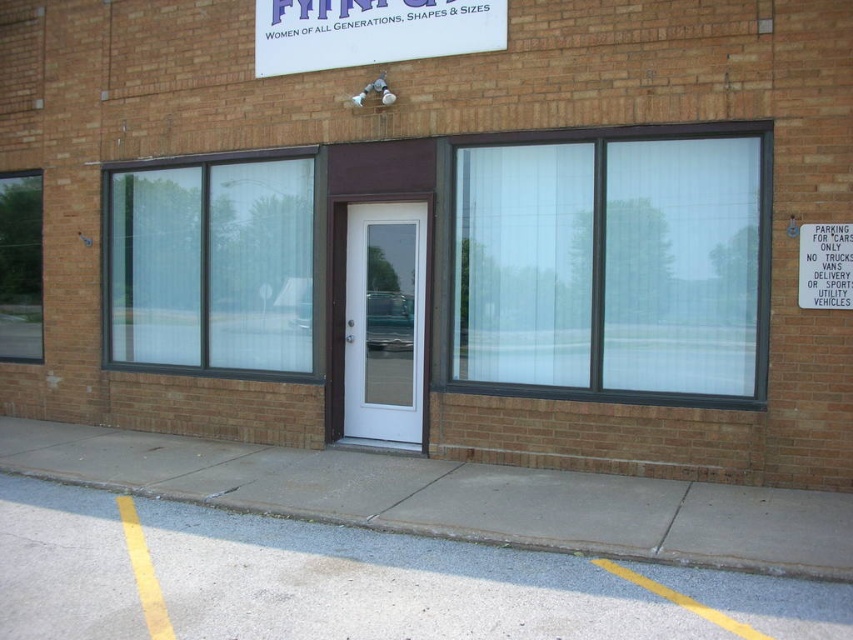
Question: Does transparent glass door at center come behind white paper sign at right?

Choices:
 (A) yes
 (B) no

Answer: (A)

Question: Does gray concrete pavement at lower left appear on the right side of clear glass window at right?

Choices:
 (A) no
 (B) yes

Answer: (A)

Question: Which point appears farthest from the camera in this image?

Choices:
 (A) (822, 236)
 (B) (19, 304)
 (C) (474, 193)
 (D) (177, 451)

Answer: (B)

Question: Does transparent glass door at center appear on the right side of white paper sign at right?

Choices:
 (A) yes
 (B) no

Answer: (B)

Question: Among these objects, which one is nearest to the camera?

Choices:
 (A) white paper sign at right
 (B) white glass door at center

Answer: (A)

Question: Which point appears farthest from the camera in this image?

Choices:
 (A) (39, 346)
 (B) (488, 45)
 (C) (590, 275)
 (D) (798, 285)

Answer: (A)